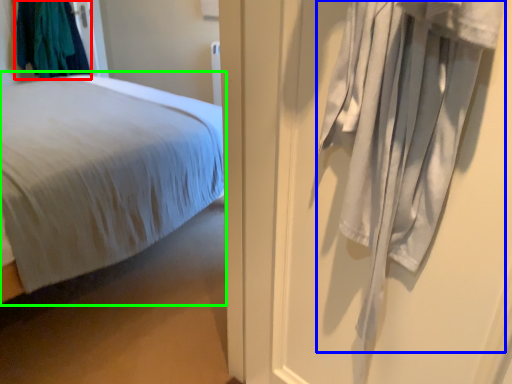
Question: Which object is positioned closest to clothing (highlighted by a red box)? Select from curtain (highlighted by a blue box) and bed (highlighted by a green box).

Choices:
 (A) curtain
 (B) bed

Answer: (B)